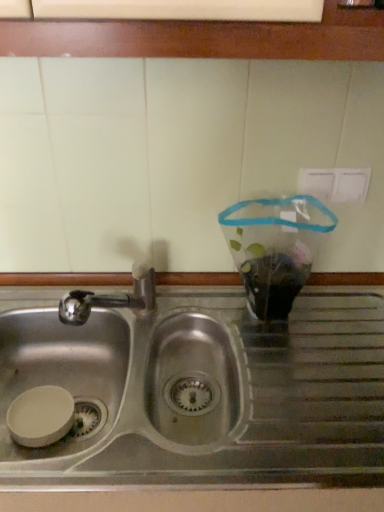
This screenshot has width=384, height=512. I want to click on metallic sink at lower center, so click(65, 279).

Describe the element at coordinates (65, 279) in the screenshot. I see `metallic sink at lower center` at that location.

You are a GUI agent. You are given a task and a screenshot of the screen. Output one action in this format:
    pyautogui.click(x=<x>, y=<y>)
    Task: Click on the stainless steel sink at center
    The image size is (384, 512).
    Given the screenshot: What is the action you would take?
    pyautogui.click(x=201, y=390)

Describe the element at coordinates (201, 390) in the screenshot. I see `stainless steel sink at center` at that location.

Identify the location of metallic sink at lower center. This screenshot has width=384, height=512. (65, 279).

Does stainless steel sink at center appear on the right side of metallic sink at lower center?

Yes, stainless steel sink at center is to the right of metallic sink at lower center.

Which object is further away from the camera, stainless steel sink at center or metallic sink at lower center?

Positioned behind is metallic sink at lower center.

Is point (245, 412) behind point (205, 284)?

No, it is in front of (205, 284).

From the image's perspective, is stainless steel sink at center above or below metallic sink at lower center?

Clearly, from the image's perspective, stainless steel sink at center is below metallic sink at lower center.

From a real-world perspective, is stainless steel sink at center over metallic sink at lower center?

Yes, from a real-world perspective, stainless steel sink at center is above metallic sink at lower center.

Considering the sizes of objects stainless steel sink at center and metallic sink at lower center in the image provided, who is thinner, stainless steel sink at center or metallic sink at lower center?

With smaller width is metallic sink at lower center.

Does stainless steel sink at center have a lesser height compared to metallic sink at lower center?

Incorrect, the height of stainless steel sink at center does not fall short of that of metallic sink at lower center.

Considering the sizes of objects stainless steel sink at center and metallic sink at lower center in the image provided, who is bigger, stainless steel sink at center or metallic sink at lower center?

Bigger between the two is stainless steel sink at center.

Does stainless steel sink at center contain metallic sink at lower center?

No, stainless steel sink at center does not contain metallic sink at lower center.

Are stainless steel sink at center and metallic sink at lower center making contact?

No, stainless steel sink at center is not next to metallic sink at lower center.

Based on the photo, is stainless steel sink at center facing towards metallic sink at lower center?

Yes, stainless steel sink at center is facing metallic sink at lower center.

How many degrees apart are the facing directions of stainless steel sink at center and metallic sink at lower center?

The facing directions of stainless steel sink at center and metallic sink at lower center are 0.0757 degrees apart.

The height and width of the screenshot is (512, 384). What are the coordinates of `sink on the right of metallic sink at lower center` in the screenshot? It's located at (201, 390).

Considering the relative positions of metallic sink at lower center and stainless steel sink at center in the image provided, is metallic sink at lower center to the left of stainless steel sink at center from the viewer's perspective?

Correct, you'll find metallic sink at lower center to the left of stainless steel sink at center.

Which object is further away from the camera, metallic sink at lower center or stainless steel sink at center?

metallic sink at lower center is further from the camera.

Considering the positions of point (38, 284) and point (271, 455), is point (38, 284) closer or farther from the camera than point (271, 455)?

Point (38, 284) is farther from the camera than point (271, 455).

From the image's perspective, would you say metallic sink at lower center is shown under stainless steel sink at center?

No, from the image's perspective, metallic sink at lower center is not below stainless steel sink at center.

From a real-world perspective, is metallic sink at lower center beneath stainless steel sink at center?

Yes.

Is metallic sink at lower center thinner than stainless steel sink at center?

Yes, metallic sink at lower center is thinner than stainless steel sink at center.

Does metallic sink at lower center have a lesser height compared to stainless steel sink at center?

Yes.

Considering the relative sizes of metallic sink at lower center and stainless steel sink at center in the image provided, is metallic sink at lower center bigger than stainless steel sink at center?

Incorrect, metallic sink at lower center is not larger than stainless steel sink at center.

Is metallic sink at lower center completely or partially outside of stainless steel sink at center?

Indeed, metallic sink at lower center is completely outside stainless steel sink at center.

Is metallic sink at lower center with stainless steel sink at center?

No, metallic sink at lower center is not making contact with stainless steel sink at center.

Is metallic sink at lower center positioned with its back to stainless steel sink at center?

Absolutely, metallic sink at lower center is directed away from stainless steel sink at center.

How different are the orientations of metallic sink at lower center and stainless steel sink at center in degrees?

metallic sink at lower center and stainless steel sink at center are facing 0.0757 degrees away from each other.

Locate an element on the screen. The height and width of the screenshot is (512, 384). sink in front of the metallic sink at lower center is located at coordinates (201, 390).

Where is `sink in front of the metallic sink at lower center`? The image size is (384, 512). sink in front of the metallic sink at lower center is located at coordinates (201, 390).

Find the location of a particular element. window sill on the left of the stainless steel sink at center is located at coordinates pyautogui.click(x=65, y=279).